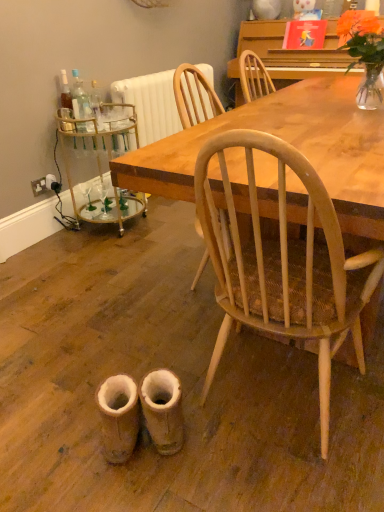
Measure the distance between point (x=90, y=106) and camera.

The depth of point (x=90, y=106) is 2.42 meters.

The width and height of the screenshot is (384, 512). I want to click on wooden table at center, so click(291, 144).

What do you see at coordinates (291, 144) in the screenshot? This screenshot has width=384, height=512. I see `wooden table at center` at bounding box center [291, 144].

The image size is (384, 512). Describe the element at coordinates (357, 25) in the screenshot. I see `orange matte flower at upper right` at that location.

I want to click on gold mirrored bar cart at left, so click(x=99, y=163).

This screenshot has height=512, width=384. Find the location of `leather boot at lower center, which is counted as the 1th walking shoe, starting from the right`. leather boot at lower center, which is counted as the 1th walking shoe, starting from the right is located at coordinates (163, 410).

Is orange matte flower at upper right facing away from leather boot at lower center, which is counted as the second walking shoe, starting from the left?

No, orange matte flower at upper right is not facing the opposite direction of leather boot at lower center, which is counted as the second walking shoe, starting from the left.

From the image's perspective, between orange matte flower at upper right and leather boot at lower center, which is counted as the 1th walking shoe, starting from the right, who is located below?

leather boot at lower center, which is counted as the 1th walking shoe, starting from the right.

Can you confirm if orange matte flower at upper right is taller than leather boot at lower center, which is counted as the 1th walking shoe, starting from the right?

Correct, orange matte flower at upper right is much taller as leather boot at lower center, which is counted as the 1th walking shoe, starting from the right.

Which is more to the left, leather boot at lower center, which is counted as the second walking shoe, starting from the left, or clear glass bottle at left?

From the viewer's perspective, clear glass bottle at left appears more on the left side.

Considering the relative sizes of leather boot at lower center, which is counted as the 1th walking shoe, starting from the right, and clear glass bottle at left in the image provided, is leather boot at lower center, which is counted as the 1th walking shoe, starting from the right, shorter than clear glass bottle at left?

Yes.

Is point (158, 425) farther from viewer compared to point (79, 129)?

No, it is in front of (79, 129).

Is leather boot at lower center, which is counted as the 1th walking shoe, starting from the right, not close to clear glass bottle at left?

Absolutely, leather boot at lower center, which is counted as the 1th walking shoe, starting from the right, is distant from clear glass bottle at left.

Would you consider orange matte vase at upper right to be distant from clear glass bottle at left?

orange matte vase at upper right is far away from clear glass bottle at left.

Consider the image. Considering their positions, is orange matte vase at upper right located in front of or behind clear glass bottle at left?

In the image, orange matte vase at upper right appears in front of clear glass bottle at left.

Which is closer to the camera, (86,124) or (173,390)?

Clearly, point (86,124) is more distant from the camera than point (173,390).

From a real-world perspective, is clear glass bottle at left positioned over leather boot at lower center, which is counted as the 1th walking shoe, starting from the right, based on gravity?

Yes.

Are clear glass bottle at left and leather boot at lower center, which is counted as the second walking shoe, starting from the left, located far from each other?

Yes, clear glass bottle at left and leather boot at lower center, which is counted as the second walking shoe, starting from the left, are located far from each other.

Based on their positions, is clear glass bottle at left located to the left or right of leather boot at lower center, which is counted as the 1th walking shoe, starting from the right?

clear glass bottle at left is to the left of leather boot at lower center, which is counted as the 1th walking shoe, starting from the right.

How different are the orientations of leather boot at lower center, which is counted as the 1th walking shoe, starting from the right, and gold mirrored bar cart at left in degrees?

The angle between the facing direction of leather boot at lower center, which is counted as the 1th walking shoe, starting from the right, and the facing direction of gold mirrored bar cart at left is 126 degrees.

Between leather boot at lower center, which is counted as the 1th walking shoe, starting from the right, and gold mirrored bar cart at left, which one has more height?

gold mirrored bar cart at left is taller.

Visually, is leather boot at lower center, which is counted as the 1th walking shoe, starting from the right, positioned to the left or to the right of gold mirrored bar cart at left?

leather boot at lower center, which is counted as the 1th walking shoe, starting from the right, is to the right of gold mirrored bar cart at left.

Looking at this image, from a real-world perspective, is leather boot at lower center, which is counted as the second walking shoe, starting from the left, under gold mirrored bar cart at left?

Yes.

How far apart are orange matte flower at upper right and gold mirrored bar cart at left?

orange matte flower at upper right is 5.88 feet from gold mirrored bar cart at left.

Does point (355, 21) come closer to viewer compared to point (62, 130)?

No, (355, 21) is further to viewer.

Is orange matte flower at upper right positioned with its back to gold mirrored bar cart at left?

orange matte flower at upper right does not have its back to gold mirrored bar cart at left.

From a real-world perspective, who is located higher, orange matte flower at upper right or gold mirrored bar cart at left?

In real-world perspective, orange matte flower at upper right is above.

Is wooden table at center not near orange matte flower at upper right?

wooden table at center is far away from orange matte flower at upper right.

From the picture: Measure the distance between wooden table at center and orange matte flower at upper right.

wooden table at center is 4.78 feet away from orange matte flower at upper right.

Could you tell me if wooden table at center is turned towards orange matte flower at upper right?

Yes, wooden table at center faces towards orange matte flower at upper right.

Is wooden table at center at the left side of orange matte flower at upper right?

Indeed, wooden table at center is positioned on the left side of orange matte flower at upper right.

This screenshot has width=384, height=512. Identify the location of walking shoe that is the 1st one below the orange matte flower at upper right (from a real-world perspective). (163, 410).

Which walking shoe is the 2nd one when counting from the front of the clear glass bottle at left? Please provide its 2D coordinates.

[(163, 410)]

Looking at the image, which one is located further to leather boot at lower center, which is counted as the 1th walking shoe, starting from the right, clear glass bottle at left or leather boot at lower left, acting as the second walking shoe starting from the right?

Among the two, clear glass bottle at left is located further to leather boot at lower center, which is counted as the 1th walking shoe, starting from the right.

Looking at the image, which one is located further to gold mirrored bar cart at left, clear glass bottle at left or orange matte flower at upper right?

orange matte flower at upper right lies further to gold mirrored bar cart at left than the other object.

Which object lies nearer to the anchor point orange matte vase at upper right, leather boot at lower left, marked as the first walking shoe in a left-to-right arrangement, or clear glass bottle at left?

The object closer to orange matte vase at upper right is clear glass bottle at left.

Looking at the image, which one is located further to orange matte flower at upper right, leather boot at lower left, acting as the second walking shoe starting from the right, or leather boot at lower center, which is counted as the second walking shoe, starting from the left?

leather boot at lower left, acting as the second walking shoe starting from the right, is further to orange matte flower at upper right.

Which object lies nearer to the anchor point leather boot at lower center, which is counted as the 1th walking shoe, starting from the right, clear glass bottle at left or wooden table at center?

The object closer to leather boot at lower center, which is counted as the 1th walking shoe, starting from the right, is wooden table at center.

Which object lies nearer to the anchor point orange matte flower at upper right, wooden table at center or clear glass bottle at left?

Among the two, wooden table at center is located nearer to orange matte flower at upper right.

Based on their spatial positions, is gold mirrored bar cart at left or leather boot at lower center, which is counted as the second walking shoe, starting from the left, further from orange matte flower at upper right?

The object further to orange matte flower at upper right is leather boot at lower center, which is counted as the second walking shoe, starting from the left.

Consider the image. Considering their positions, is orange matte flower at upper right positioned closer to clear glass bottle at left than leather boot at lower left, marked as the first walking shoe in a left-to-right arrangement?

The object closer to clear glass bottle at left is leather boot at lower left, marked as the first walking shoe in a left-to-right arrangement.

At what (x,y) coordinates should I click in order to perform the action: click on houseplant that lies between clear glass bottle at left and leather boot at lower center, which is counted as the 1th walking shoe, starting from the right, from top to bottom. Please return your answer as a coordinate pair (x, y). The height and width of the screenshot is (512, 384). Looking at the image, I should click on (364, 53).

Where is `side table between orange matte vase at upper right and leather boot at lower left, acting as the second walking shoe starting from the right, in the up-down direction`? side table between orange matte vase at upper right and leather boot at lower left, acting as the second walking shoe starting from the right, in the up-down direction is located at coordinates click(99, 163).

Where is `houseplant between orange matte flower at upper right and leather boot at lower left, acting as the second walking shoe starting from the right, in the up-down direction`? This screenshot has height=512, width=384. houseplant between orange matte flower at upper right and leather boot at lower left, acting as the second walking shoe starting from the right, in the up-down direction is located at coordinates (364, 53).

Where is `side table between orange matte flower at upper right and leather boot at lower left, acting as the second walking shoe starting from the right, from top to bottom`? This screenshot has width=384, height=512. side table between orange matte flower at upper right and leather boot at lower left, acting as the second walking shoe starting from the right, from top to bottom is located at coordinates (99, 163).